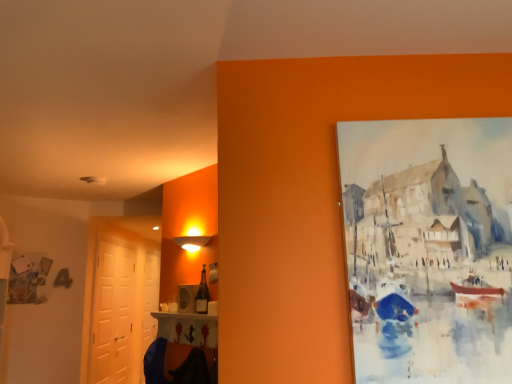
Question: Is white matte door at left, acting as the second door starting from the back, bigger than matte glass bottle at center?

Choices:
 (A) no
 (B) yes

Answer: (B)

Question: Is white matte door at left, acting as the second door starting from the back, shorter than matte glass bottle at center?

Choices:
 (A) yes
 (B) no

Answer: (B)

Question: Would you say matte glass bottle at center is part of white matte door at left, the first door when ordered from front to back,'s contents?

Choices:
 (A) yes
 (B) no

Answer: (B)

Question: Is white matte door at left, acting as the second door starting from the back, not close to matte glass bottle at center?

Choices:
 (A) no
 (B) yes

Answer: (B)

Question: Does white matte door at left, the first door when ordered from front to back, lie in front of matte glass bottle at center?

Choices:
 (A) yes
 (B) no

Answer: (B)

Question: Could you tell me if white matte door at left, acting as the second door starting from the back, is facing matte glass bottle at center?

Choices:
 (A) yes
 (B) no

Answer: (B)

Question: Does white matte door at left, the first door when ordered from front to back, come in front of white glossy door at left, the second door when ordered from front to back?

Choices:
 (A) no
 (B) yes

Answer: (B)

Question: From a real-world perspective, is white matte door at left, acting as the second door starting from the back, under white glossy door at left, the second door when ordered from front to back?

Choices:
 (A) yes
 (B) no

Answer: (B)

Question: Is white matte door at left, acting as the second door starting from the back, taller than white glossy door at left, which is counted as the 1th door, starting from the back?

Choices:
 (A) no
 (B) yes

Answer: (A)

Question: Is white matte door at left, the first door when ordered from front to back, at the left side of white glossy door at left, the second door when ordered from front to back?

Choices:
 (A) no
 (B) yes

Answer: (B)

Question: Does white matte door at left, the first door when ordered from front to back, have a smaller size compared to white glossy door at left, the second door when ordered from front to back?

Choices:
 (A) yes
 (B) no

Answer: (B)

Question: Can you confirm if white matte door at left, acting as the second door starting from the back, is wider than white glossy door at left, the second door when ordered from front to back?

Choices:
 (A) no
 (B) yes

Answer: (B)

Question: Does white glossy door at left, which is counted as the 1th door, starting from the back, appear on the left side of matte glass bottle at center?

Choices:
 (A) no
 (B) yes

Answer: (B)